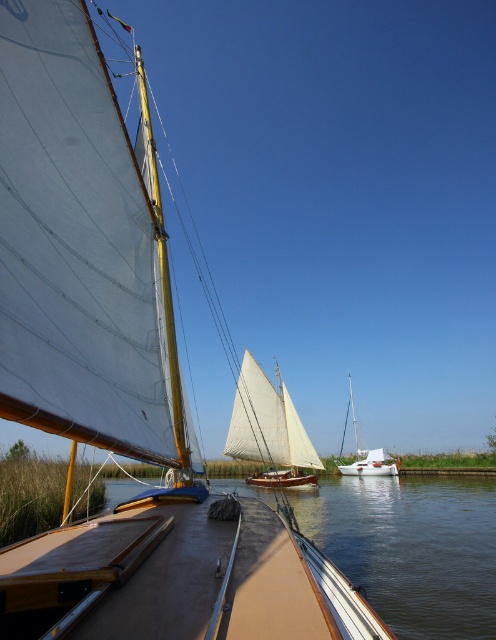
Who is more distant from viewer, (255, 422) or (379, 449)?

The point (379, 449) is more distant.

Which is below, white canvas sailboat at center or white matte sailboat at center?

Positioned lower is white matte sailboat at center.

Where is `white canvas sailboat at center`? This screenshot has width=496, height=640. white canvas sailboat at center is located at coordinates (268, 428).